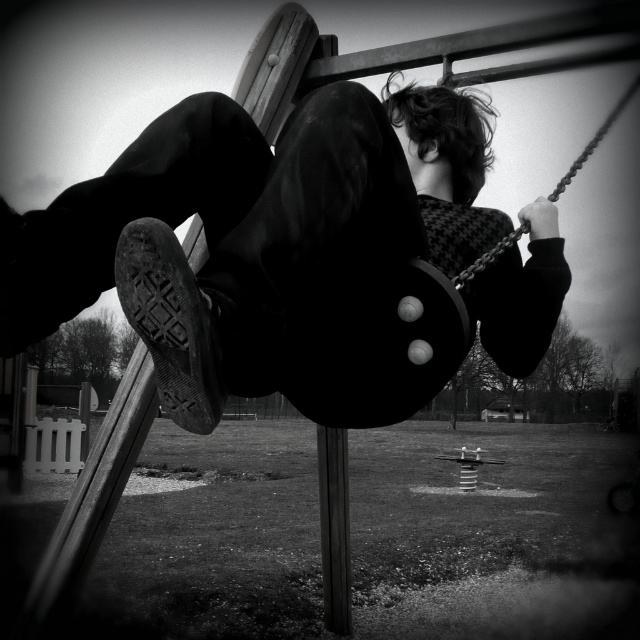
Who is higher up, dark fabric pants at center or smooth wood pole at center?

dark fabric pants at center is higher up.

Is dark fabric pants at center smaller than smooth wood pole at center?

No.

Image resolution: width=640 pixels, height=640 pixels. Identify the location of dark fabric pants at center. (266, 246).

At what (x,y) coordinates should I click in order to perform the action: click on dark fabric pants at center. Please return your answer as a coordinate pair (x, y). The width and height of the screenshot is (640, 640). Looking at the image, I should click on (266, 246).